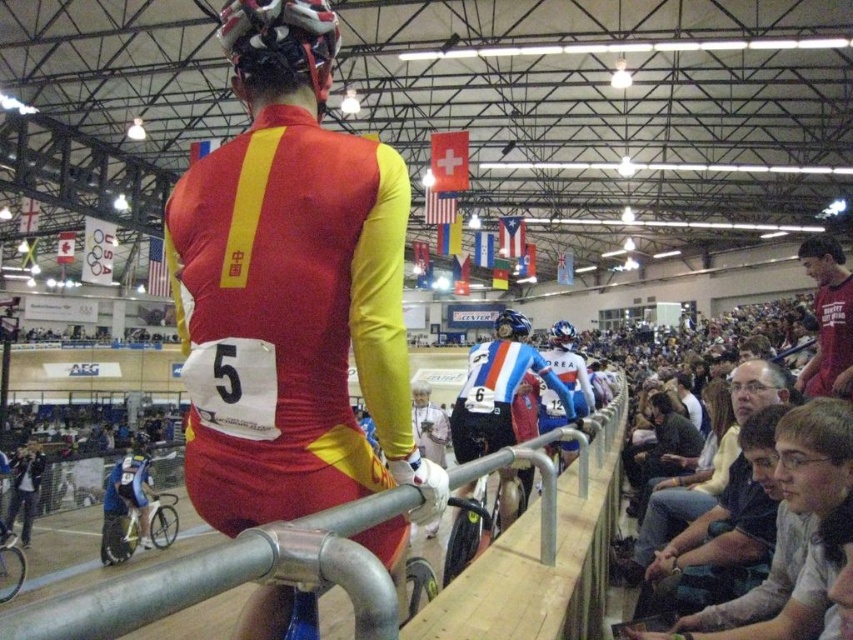
You are a photographer positioned at the front of the arena. You want to take a photo of both the shiny metallic helmet at upper center and the blue glossy bicycle helmet at center. Which helmet should you adjust your camera to focus on first if you want to capture them from left to right in the frame?

The shiny metallic helmet at upper center should be focused on first since it is positioned to the left of the blue glossy bicycle helmet at center, aligning with the left to right order.

You are a photographer positioned at the center of the arena. You want to take a photo that includes both the point at coordinates point [189,218] and point [505,323]. Which point will appear closer to the edge of the photo?

Point [189,218] is closer to the camera than point [505,323], so in the photo, point [189,218] will appear closer to the edge of the photo.

You are a photographer at the cycling event and want to capture both the shiny metallic helmet at upper center and the blue glossy bicycle helmet at center in a single shot. Which helmet should you focus on first to ensure both are in frame?

The shiny metallic helmet at upper center has a smaller size compared to blue glossy bicycle helmet at center. To ensure both are in frame, focus on the larger blue glossy bicycle helmet at center first, then adjust the camera angle to include the smaller shiny metallic helmet at upper center.